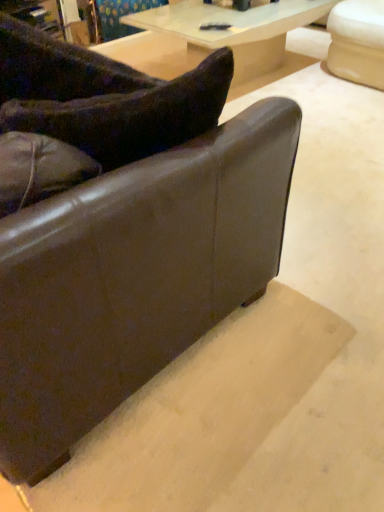
Question: Is brown leather couch at lower left located within translucent glass table at upper center?

Choices:
 (A) no
 (B) yes

Answer: (A)

Question: Can you confirm if translucent glass table at upper center is smaller than brown leather couch at lower left?

Choices:
 (A) no
 (B) yes

Answer: (B)

Question: Considering the relative sizes of translucent glass table at upper center and brown leather couch at lower left in the image provided, is translucent glass table at upper center wider than brown leather couch at lower left?

Choices:
 (A) yes
 (B) no

Answer: (B)

Question: Would you consider translucent glass table at upper center to be distant from brown leather couch at lower left?

Choices:
 (A) yes
 (B) no

Answer: (A)

Question: From a real-world perspective, is translucent glass table at upper center positioned over brown leather couch at lower left based on gravity?

Choices:
 (A) yes
 (B) no

Answer: (B)

Question: Does translucent glass table at upper center come in front of brown leather couch at lower left?

Choices:
 (A) yes
 (B) no

Answer: (B)

Question: From the image's perspective, is brown leather couch at lower left on top of translucent glass table at upper center?

Choices:
 (A) no
 (B) yes

Answer: (A)

Question: Can you confirm if brown leather couch at lower left is shorter than translucent glass table at upper center?

Choices:
 (A) yes
 (B) no

Answer: (B)

Question: Is the depth of brown leather couch at lower left less than that of translucent glass table at upper center?

Choices:
 (A) no
 (B) yes

Answer: (B)

Question: Is brown leather couch at lower left facing towards translucent glass table at upper center?

Choices:
 (A) no
 (B) yes

Answer: (B)

Question: Is brown leather couch at lower left completely or partially outside of translucent glass table at upper center?

Choices:
 (A) no
 (B) yes

Answer: (B)

Question: Can you confirm if brown leather couch at lower left is taller than translucent glass table at upper center?

Choices:
 (A) no
 (B) yes

Answer: (B)

Question: Can you confirm if translucent glass table at upper center is taller than velvety dark brown pillow at upper left?

Choices:
 (A) yes
 (B) no

Answer: (A)